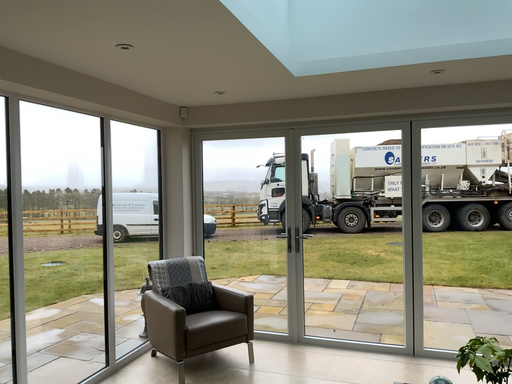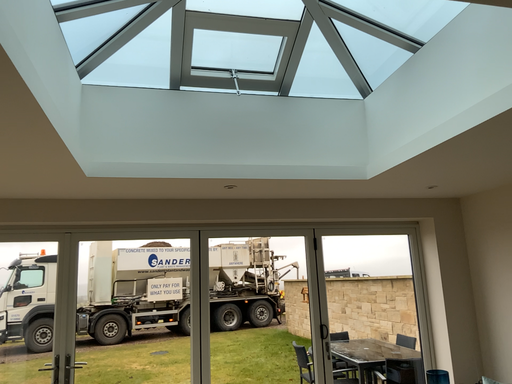
Question: Which way did the camera rotate in the video?

Choices:
 (A) rotated left
 (B) rotated right

Answer: (B)